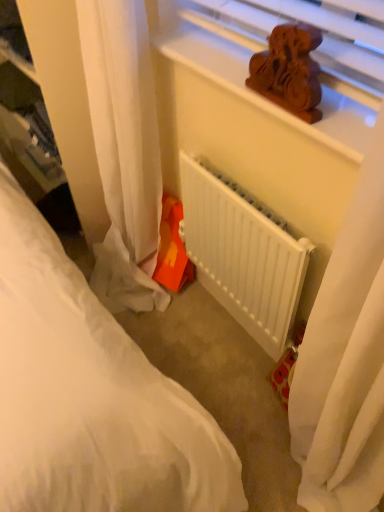
Question: Would you say brown wooden statue at upper center contains wooden carving at upper center?

Choices:
 (A) yes
 (B) no

Answer: (B)

Question: From a real-world perspective, is brown wooden statue at upper center located beneath wooden carving at upper center?

Choices:
 (A) no
 (B) yes

Answer: (A)

Question: Is brown wooden statue at upper center completely or partially outside of wooden carving at upper center?

Choices:
 (A) no
 (B) yes

Answer: (B)

Question: Is brown wooden statue at upper center positioned before wooden carving at upper center?

Choices:
 (A) no
 (B) yes

Answer: (B)

Question: Considering the relative sizes of brown wooden statue at upper center and wooden carving at upper center in the image provided, is brown wooden statue at upper center bigger than wooden carving at upper center?

Choices:
 (A) no
 (B) yes

Answer: (A)

Question: Is white matte radiator at center spatially inside white sheer curtain at lower left, or outside of it?

Choices:
 (A) outside
 (B) inside

Answer: (A)

Question: Is white matte radiator at center bigger or smaller than white sheer curtain at lower left?

Choices:
 (A) big
 (B) small

Answer: (B)

Question: In the image, is white matte radiator at center on the left side or the right side of white sheer curtain at lower left?

Choices:
 (A) right
 (B) left

Answer: (A)

Question: Is white matte radiator at center taller or shorter than white sheer curtain at lower left?

Choices:
 (A) short
 (B) tall

Answer: (A)

Question: In terms of size, does wooden carving at upper center appear bigger or smaller than orange plastic toy at lower center?

Choices:
 (A) big
 (B) small

Answer: (B)

Question: Would you say wooden carving at upper center is inside or outside orange plastic toy at lower center?

Choices:
 (A) outside
 (B) inside

Answer: (A)

Question: From a real-world perspective, is wooden carving at upper center physically located above or below orange plastic toy at lower center?

Choices:
 (A) above
 (B) below

Answer: (A)

Question: In the image, is wooden carving at upper center on the left side or the right side of orange plastic toy at lower center?

Choices:
 (A) left
 (B) right

Answer: (B)

Question: Considering the positions of wooden carving at upper center and white matte radiator at center in the image, is wooden carving at upper center wider or thinner than white matte radiator at center?

Choices:
 (A) thin
 (B) wide

Answer: (B)

Question: Does point (354, 159) appear closer or farther from the camera than point (276, 272)?

Choices:
 (A) farther
 (B) closer

Answer: (B)